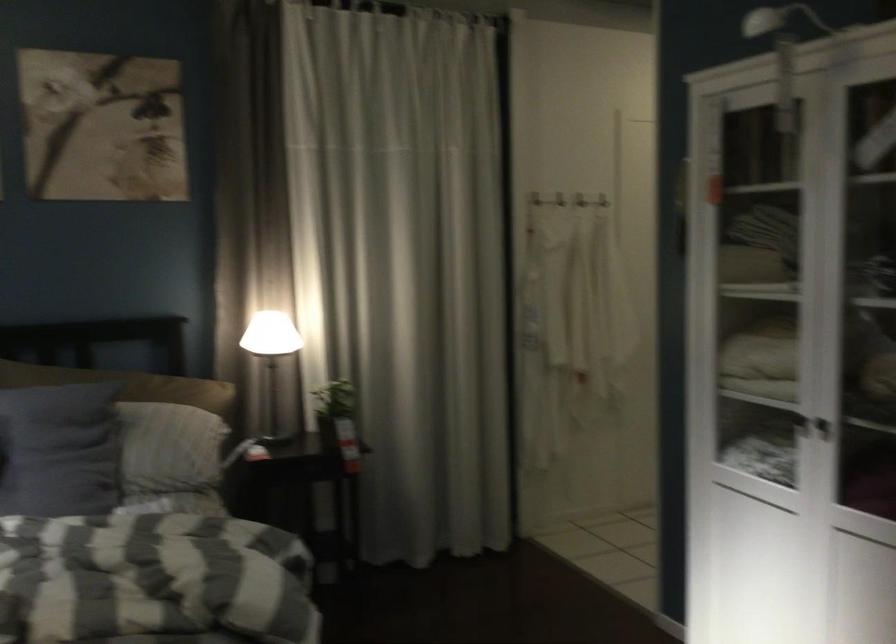
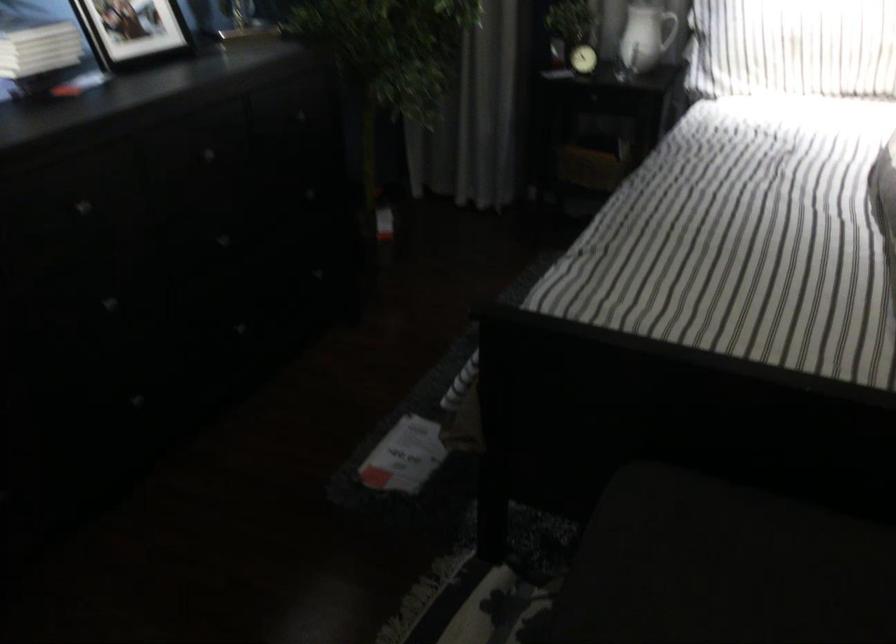
How did the camera likely rotate?

The rotation direction of the camera is left-down.